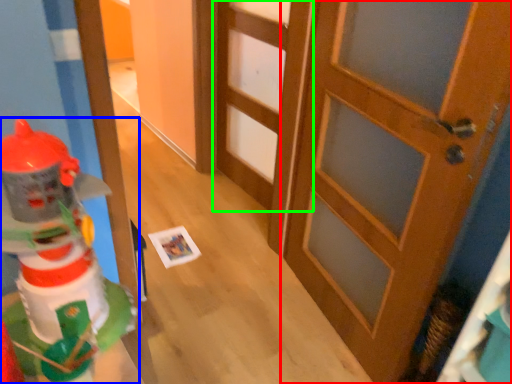
Question: Estimate the real-world distances between objects in this image. Which object is closer to door (highlighted by a red box), toy (highlighted by a blue box) or door (highlighted by a green box)?

Choices:
 (A) toy
 (B) door

Answer: (B)